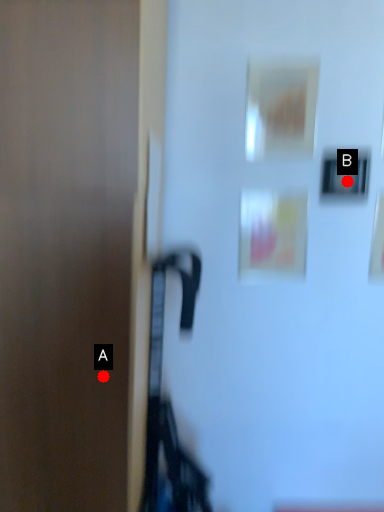
Question: Two points are circled on the image, labeled by A and B beside each circle. Which point is closer to the camera?

Choices:
 (A) A is closer
 (B) B is closer

Answer: (A)